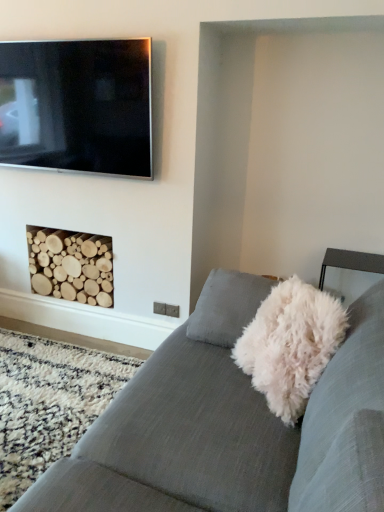
This screenshot has height=512, width=384. Identify the location of textured gray couch at center. (231, 436).

This screenshot has width=384, height=512. Describe the element at coordinates (77, 106) in the screenshot. I see `flat screen tv at upper left` at that location.

Where is `textured gray couch at center`? The image size is (384, 512). textured gray couch at center is located at coordinates (231, 436).

Considering the sizes of objects natural wood logs at lower left and textured gray couch at center in the image provided, who is bigger, natural wood logs at lower left or textured gray couch at center?

textured gray couch at center is bigger.

Based on the photo, who is taller, natural wood logs at lower left or textured gray couch at center?

textured gray couch at center is taller.

Is there a large distance between natural wood logs at lower left and textured gray couch at center?

That's right, there is a large distance between natural wood logs at lower left and textured gray couch at center.

From a real-world perspective, is natural wood logs at lower left beneath flat screen tv at upper left?

Correct, in the physical world, natural wood logs at lower left is lower than flat screen tv at upper left.

Is natural wood logs at lower left next to flat screen tv at upper left and touching it?

No, natural wood logs at lower left is not next to flat screen tv at upper left.

From the image's perspective, between natural wood logs at lower left and flat screen tv at upper left, which one is located above?

flat screen tv at upper left, from the image's perspective.

Can you confirm if textured gray couch at center is positioned to the right of flat screen tv at upper left?

Indeed, textured gray couch at center is positioned on the right side of flat screen tv at upper left.

From a real-world perspective, is textured gray couch at center physically located above or below flat screen tv at upper left?

Clearly, from a real-world perspective, textured gray couch at center is below flat screen tv at upper left.

Does point (266, 475) come in front of point (109, 53)?

Yes, it is in front of point (109, 53).

Could you tell me if textured gray couch at center is turned towards flat screen tv at upper left?

No, textured gray couch at center is not facing towards flat screen tv at upper left.

Image resolution: width=384 pixels, height=512 pixels. In order to click on studio couch above the natural wood logs at lower left (from a real-world perspective) in this screenshot , I will do `click(231, 436)`.

Is textured gray couch at center looking in the opposite direction of natural wood logs at lower left?

textured gray couch at center does not have its back to natural wood logs at lower left.

Between point (358, 461) and point (78, 295), which one is positioned behind?

The point (78, 295) is behind.

Does textured gray couch at center have a lesser height compared to natural wood logs at lower left?

Incorrect, the height of textured gray couch at center does not fall short of that of natural wood logs at lower left.

Is flat screen tv at upper left at the left side of textured gray couch at center?

Yes, flat screen tv at upper left is to the left of textured gray couch at center.

Is flat screen tv at upper left in contact with textured gray couch at center?

flat screen tv at upper left is not next to textured gray couch at center, and they're not touching.

Is flat screen tv at upper left situated inside textured gray couch at center or outside?

flat screen tv at upper left is spatially situated outside textured gray couch at center.

In the scene shown: From the image's perspective, is flat screen tv at upper left located beneath textured gray couch at center?

No, from the image's perspective, flat screen tv at upper left is not below textured gray couch at center.

Between flat screen tv at upper left and natural wood logs at lower left, which one has larger size?

natural wood logs at lower left is bigger.

Is flat screen tv at upper left completely or partially outside of natural wood logs at lower left?

Yes, flat screen tv at upper left is not within natural wood logs at lower left.

Does point (49, 50) appear closer or farther from the camera than point (103, 274)?

Point (49, 50) appears to be closer to the viewer than point (103, 274).

In the image, there is a flat screen tv at upper left. Where is `fireplace below it (from a real-world perspective)`? The height and width of the screenshot is (512, 384). fireplace below it (from a real-world perspective) is located at coordinates (71, 265).

Find the location of `fireplace to the left of textured gray couch at center`. fireplace to the left of textured gray couch at center is located at coordinates (71, 265).

Find the location of a particular element. The width and height of the screenshot is (384, 512). fireplace below the flat screen tv at upper left (from the image's perspective) is located at coordinates (71, 265).

From the image, which object appears to be farther from flat screen tv at upper left, textured gray couch at center or natural wood logs at lower left?

Based on the image, textured gray couch at center appears to be further to flat screen tv at upper left.

From the image, which object appears to be farther from natural wood logs at lower left, textured gray couch at center or flat screen tv at upper left?

textured gray couch at center is further to natural wood logs at lower left.

Which object lies further to the anchor point flat screen tv at upper left, natural wood logs at lower left or textured gray couch at center?

textured gray couch at center.

Looking at this image, when comparing their distances from textured gray couch at center, does flat screen tv at upper left or natural wood logs at lower left seem further?

flat screen tv at upper left lies further to textured gray couch at center than the other object.

Which object lies further to the anchor point natural wood logs at lower left, flat screen tv at upper left or textured gray couch at center?

The object further to natural wood logs at lower left is textured gray couch at center.

In the scene shown: When comparing their distances from textured gray couch at center, does natural wood logs at lower left or flat screen tv at upper left seem further?

Based on the image, flat screen tv at upper left appears to be further to textured gray couch at center.

The height and width of the screenshot is (512, 384). In order to click on television between textured gray couch at center and natural wood logs at lower left from front to back in this screenshot , I will do tap(77, 106).